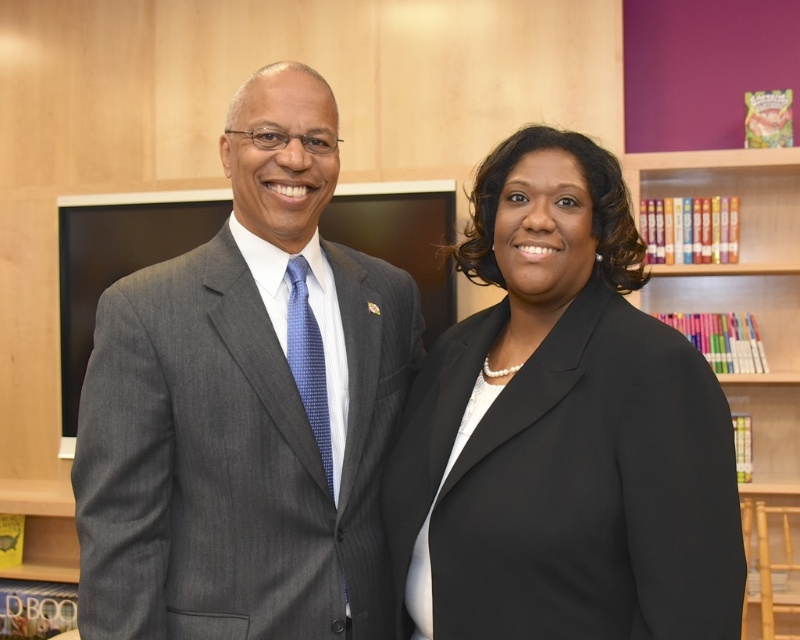
How distant is black satin blazer at center from multicolored paperbacks at upper right?

black satin blazer at center and multicolored paperbacks at upper right are 6.98 feet apart from each other.

Can you confirm if black satin blazer at center is shorter than multicolored paperbacks at upper right?

Indeed, black satin blazer at center has a lesser height compared to multicolored paperbacks at upper right.

Describe the element at coordinates (562, 429) in the screenshot. I see `black satin blazer at center` at that location.

Image resolution: width=800 pixels, height=640 pixels. In order to click on black satin blazer at center in this screenshot , I will do `click(562, 429)`.

Is point (85, 436) more distant than point (720, 186)?

That is False.

Who is positioned more to the left, matte gray suit at left or multicolored paperbacks at upper right?

Positioned to the left is matte gray suit at left.

Describe the element at coordinates (246, 406) in the screenshot. This screenshot has width=800, height=640. I see `matte gray suit at left` at that location.

Locate an element on the screen. matte gray suit at left is located at coordinates (246, 406).

Who is more distant from viewer, (110, 400) or (606, 333)?

Positioned behind is point (110, 400).

Which is in front, point (326, 134) or point (652, 522)?

Point (652, 522) is more forward.

Locate an element on the screen. matte gray suit at left is located at coordinates (246, 406).